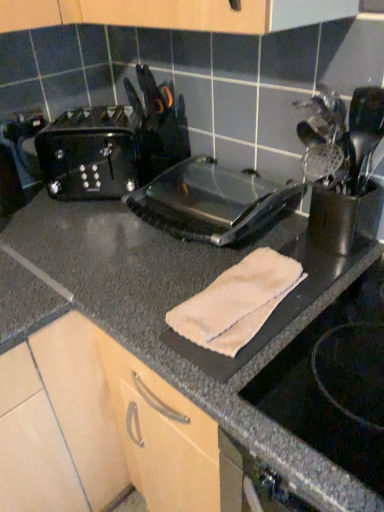
Question: Can we say black plastic toaster at left lies outside satin silver utensil holder at right?

Choices:
 (A) no
 (B) yes

Answer: (B)

Question: Is black plastic toaster at left next to satin silver utensil holder at right?

Choices:
 (A) no
 (B) yes

Answer: (A)

Question: Does black plastic toaster at left have a smaller size compared to satin silver utensil holder at right?

Choices:
 (A) no
 (B) yes

Answer: (A)

Question: Does black plastic toaster at left have a greater width compared to satin silver utensil holder at right?

Choices:
 (A) no
 (B) yes

Answer: (B)

Question: From a real-world perspective, is black plastic toaster at left beneath satin silver utensil holder at right?

Choices:
 (A) yes
 (B) no

Answer: (A)

Question: Based on their positions, is black plastic toaster at left located to the left or right of beige cotton towel at center?

Choices:
 (A) left
 (B) right

Answer: (A)

Question: In terms of size, does black plastic toaster at left appear bigger or smaller than beige cotton towel at center?

Choices:
 (A) big
 (B) small

Answer: (A)

Question: Considering the positions of black plastic toaster at left and beige cotton towel at center in the image, is black plastic toaster at left wider or thinner than beige cotton towel at center?

Choices:
 (A) wide
 (B) thin

Answer: (B)

Question: From a real-world perspective, relative to beige cotton towel at center, is black plastic toaster at left vertically above or below?

Choices:
 (A) above
 (B) below

Answer: (A)

Question: Looking at the image, does transparent plastic toaster at center seem bigger or smaller compared to black plastic toaster at left?

Choices:
 (A) big
 (B) small

Answer: (A)

Question: Considering the positions of point (172, 208) and point (69, 157), is point (172, 208) closer or farther from the camera than point (69, 157)?

Choices:
 (A) farther
 (B) closer

Answer: (B)

Question: Would you say transparent plastic toaster at center is to the left or to the right of black plastic toaster at left in the picture?

Choices:
 (A) left
 (B) right

Answer: (B)

Question: Is transparent plastic toaster at center wider or thinner than black plastic toaster at left?

Choices:
 (A) wide
 (B) thin

Answer: (A)

Question: Considering their positions, is satin silver utensil holder at right located in front of or behind black plastic toaster at left?

Choices:
 (A) behind
 (B) front

Answer: (B)

Question: Is satin silver utensil holder at right to the left or to the right of black plastic toaster at left in the image?

Choices:
 (A) left
 (B) right

Answer: (B)